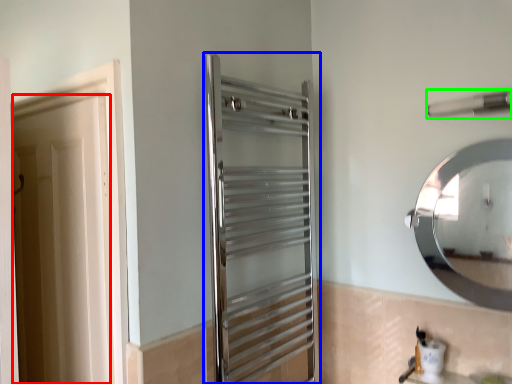
Question: Which object is positioned farthest from door (highlighted by a red box)? Select from screen door (highlighted by a blue box) and towel bar (highlighted by a green box).

Choices:
 (A) screen door
 (B) towel bar

Answer: (B)